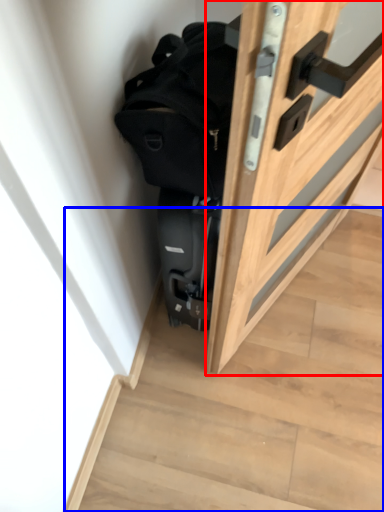
Question: Which point is further to the camera, door (highlighted by a red box) or stairwell (highlighted by a blue box)?

Choices:
 (A) door
 (B) stairwell

Answer: (B)